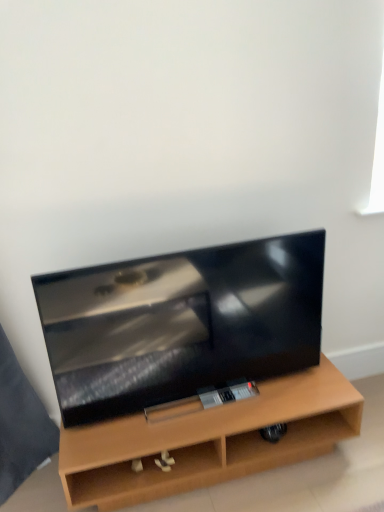
Locate an element on the screen. This screenshot has height=512, width=384. free space above matte wood tv stand at center (from a real-world perspective) is located at coordinates (210, 404).